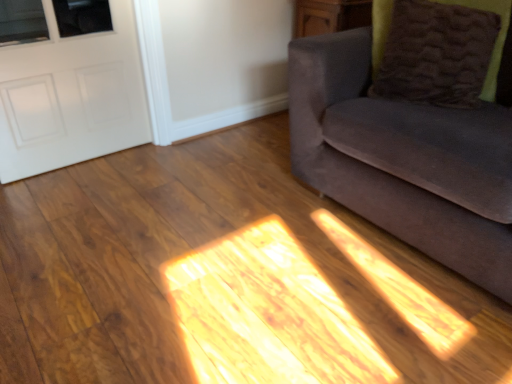
Question: From a real-world perspective, is white matte door at left over brown fuzzy pillow at upper right?

Choices:
 (A) no
 (B) yes

Answer: (A)

Question: Could you tell me if white matte door at left is facing brown fuzzy pillow at upper right?

Choices:
 (A) yes
 (B) no

Answer: (B)

Question: Is the position of white matte door at left less distant than that of brown fuzzy pillow at upper right?

Choices:
 (A) yes
 (B) no

Answer: (B)

Question: Could brown fuzzy pillow at upper right be considered to be inside white matte door at left?

Choices:
 (A) yes
 (B) no

Answer: (B)

Question: Does white matte door at left have a larger size compared to brown fuzzy pillow at upper right?

Choices:
 (A) yes
 (B) no

Answer: (A)

Question: Does white matte door at left appear on the right side of brown fuzzy pillow at upper right?

Choices:
 (A) no
 (B) yes

Answer: (A)

Question: Is brown fuzzy pillow at upper right wider than white matte door at left?

Choices:
 (A) no
 (B) yes

Answer: (B)

Question: Does brown fuzzy pillow at upper right have a greater height compared to white matte door at left?

Choices:
 (A) no
 (B) yes

Answer: (A)

Question: Is white matte door at left a part of brown fuzzy pillow at upper right?

Choices:
 (A) no
 (B) yes

Answer: (A)

Question: From the image's perspective, would you say brown fuzzy pillow at upper right is shown under white matte door at left?

Choices:
 (A) yes
 (B) no

Answer: (B)

Question: Is brown fuzzy pillow at upper right located outside white matte door at left?

Choices:
 (A) no
 (B) yes

Answer: (B)

Question: Is brown fuzzy pillow at upper right far from white matte door at left?

Choices:
 (A) no
 (B) yes

Answer: (B)

Question: Does brown fuzzy pillow at upper right have a greater width compared to velvet gray couch at right?

Choices:
 (A) yes
 (B) no

Answer: (B)